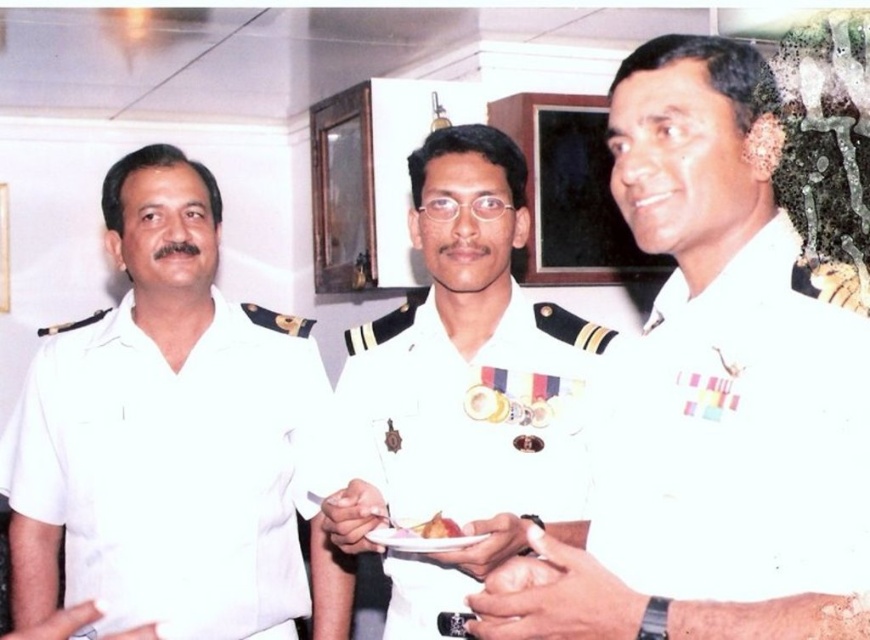
Question: Which point appears farthest from the camera in this image?

Choices:
 (A) (157, 540)
 (B) (376, 529)
 (C) (677, 310)

Answer: (A)

Question: Does white uniform at left have a larger size compared to white paper plate at center?

Choices:
 (A) no
 (B) yes

Answer: (B)

Question: Is white cotton shirt at right thinner than smooth brown cake at center?

Choices:
 (A) yes
 (B) no

Answer: (B)

Question: Which point is farther to the camera?

Choices:
 (A) smooth brown cake at center
 (B) white glossy uniform at center
 (C) white uniform at left
 (D) white cotton shirt at right

Answer: (C)

Question: Can you confirm if white glossy uniform at center is smaller than white paper plate at center?

Choices:
 (A) no
 (B) yes

Answer: (A)

Question: Which point appears closest to the camera in this image?

Choices:
 (A) (619, 472)
 (B) (128, 561)

Answer: (A)